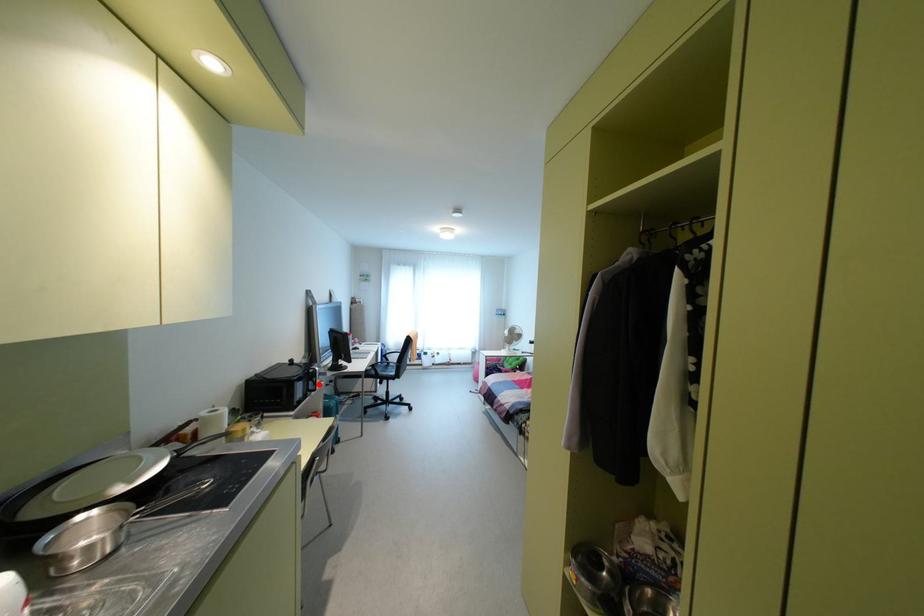
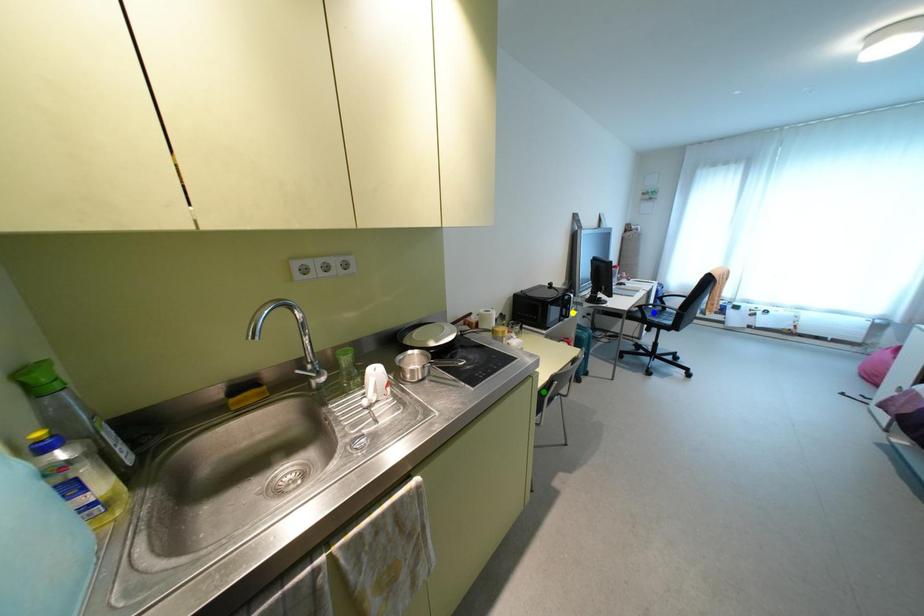
Question: I am providing you with two images of the same scene from different viewpoints. A red point is marked on the first image. You are given multiple points on the second image. Which point in image 2 is actually the same real-world point as the red point in image 1?

Choices:
 (A) blue point
 (B) green point
 (C) yellow point

Answer: (C)